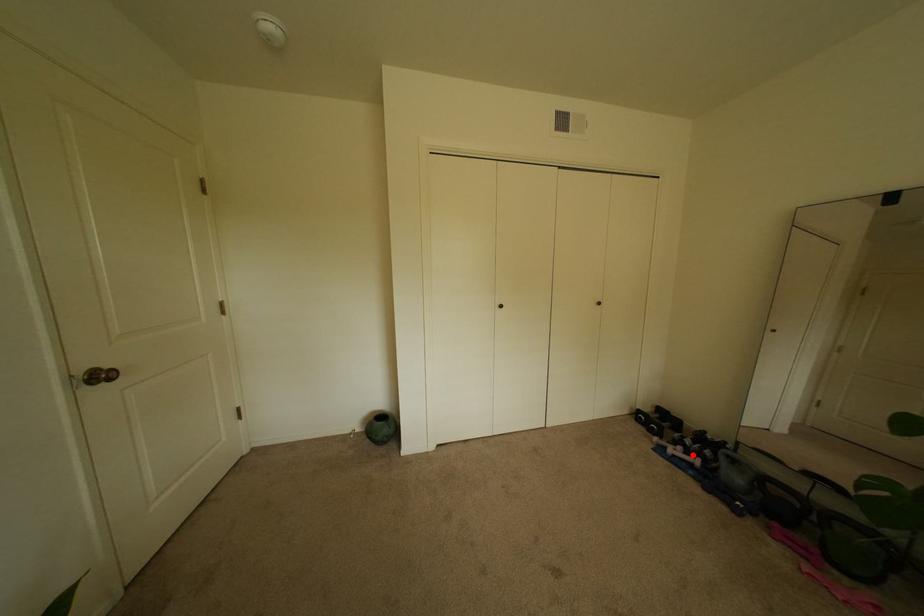
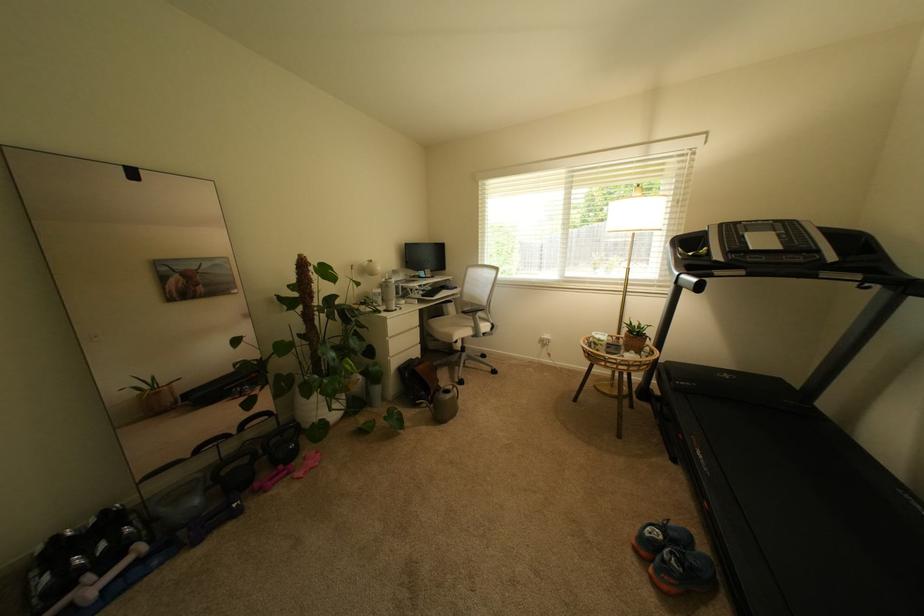
In the second image, find the point that corresponds to the highlighted location in the first image.

(111, 573)